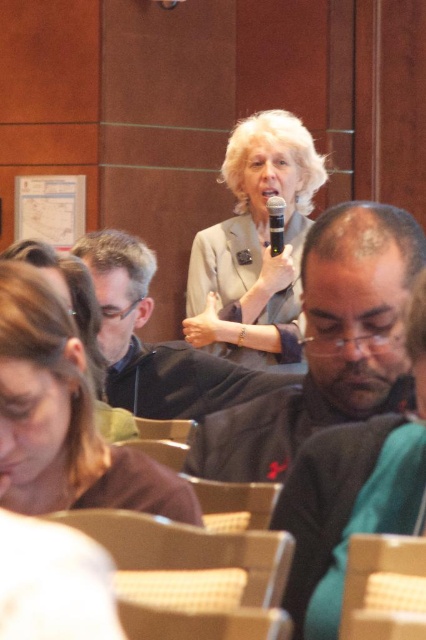
Question: Is light gray suit at center thinner than matte black jacket at center?

Choices:
 (A) no
 (B) yes

Answer: (B)

Question: Is matte black suit at center further to the viewer compared to wooden at center?

Choices:
 (A) no
 (B) yes

Answer: (B)

Question: In this image, where is matte black suit at center located relative to silver metallic microphone at center?

Choices:
 (A) left
 (B) right

Answer: (A)

Question: Which object is farther from the camera taking this photo?

Choices:
 (A) matte black hair at lower left
 (B) light gray suit at center

Answer: (B)

Question: Considering the real-world distances, which object is closest to the matte black suit at center?

Choices:
 (A) light gray suit at center
 (B) silver metallic microphone at center
 (C) matte black hair at lower left

Answer: (C)

Question: Which point is closer to the camera?

Choices:
 (A) (294, 284)
 (B) (32, 317)
 (C) (262, 476)

Answer: (B)